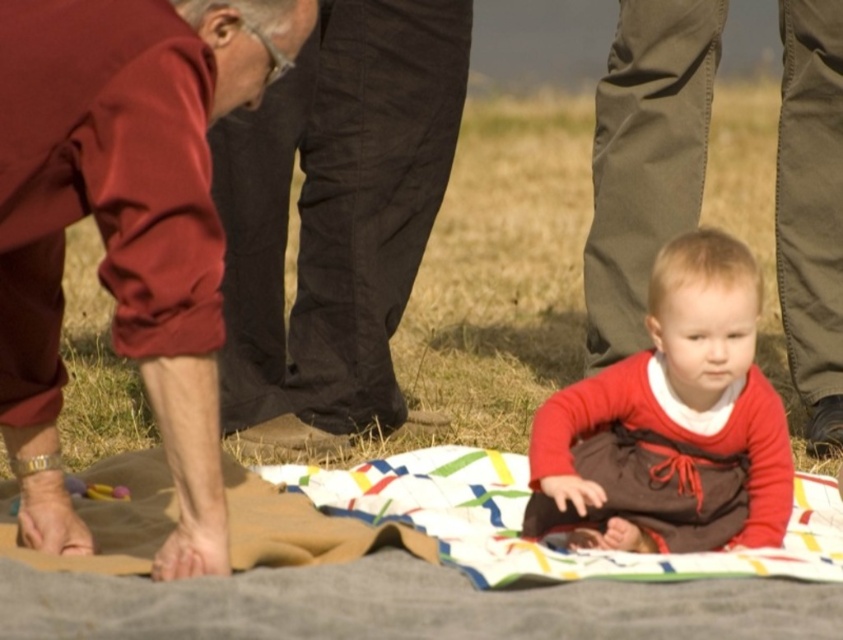
Between red cotton shirt at center and matte red dress at center, which one is positioned lower?

matte red dress at center is below.

Is red cotton shirt at center to the right of matte red dress at center from the viewer's perspective?

Indeed, red cotton shirt at center is positioned on the right side of matte red dress at center.

Measure the distance between red cotton shirt at center and camera.

The distance of red cotton shirt at center from camera is 17.66 feet.

Image resolution: width=843 pixels, height=640 pixels. In order to click on red cotton shirt at center in this screenshot , I will do click(645, 157).

Is dark brown pants at left to the left of red cotton shirt at center from the viewer's perspective?

Indeed, dark brown pants at left is positioned on the left side of red cotton shirt at center.

Is dark brown pants at left below red cotton shirt at center?

Actually, dark brown pants at left is above red cotton shirt at center.

You are a GUI agent. You are given a task and a screenshot of the screen. Output one action in this format:
    pyautogui.click(x=<x>, y=<y>)
    Task: Click on the dark brown pants at left
    The width and height of the screenshot is (843, 640).
    Given the screenshot: What is the action you would take?
    pyautogui.click(x=336, y=220)

Does dark brown pants at left have a greater height compared to maroon fabric pants at lower left?

Indeed, dark brown pants at left has a greater height compared to maroon fabric pants at lower left.

Does dark brown pants at left have a greater width compared to maroon fabric pants at lower left?

Indeed, dark brown pants at left has a greater width compared to maroon fabric pants at lower left.

Image resolution: width=843 pixels, height=640 pixels. What are the coordinates of `dark brown pants at left` in the screenshot? It's located at (336, 220).